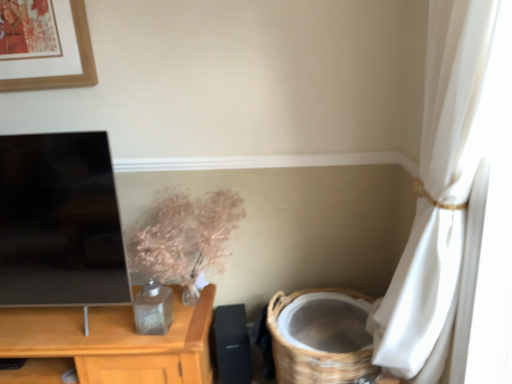
Question: From a real-world perspective, relative to black matte speaker at lower center, is metallic floral arrangement at center vertically above or below?

Choices:
 (A) below
 (B) above

Answer: (B)

Question: Looking at their shapes, would you say metallic floral arrangement at center is wider or thinner than black matte speaker at lower center?

Choices:
 (A) thin
 (B) wide

Answer: (B)

Question: Considering the real-world distances, which object is farthest from the black matte speaker at lower center?

Choices:
 (A) woven brown basket at lower right
 (B) metallic floral arrangement at center

Answer: (B)

Question: Which of these objects is positioned closest to the metallic floral arrangement at center?

Choices:
 (A) black matte speaker at lower center
 (B) woven brown basket at lower right

Answer: (A)